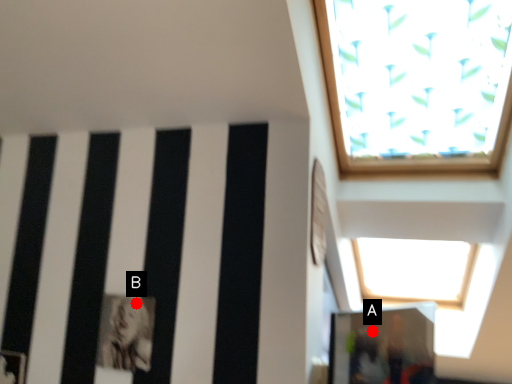
Question: Two points are circled on the image, labeled by A and B beside each circle. Which point appears farthest from the camera in this image?

Choices:
 (A) A is further
 (B) B is further

Answer: (A)